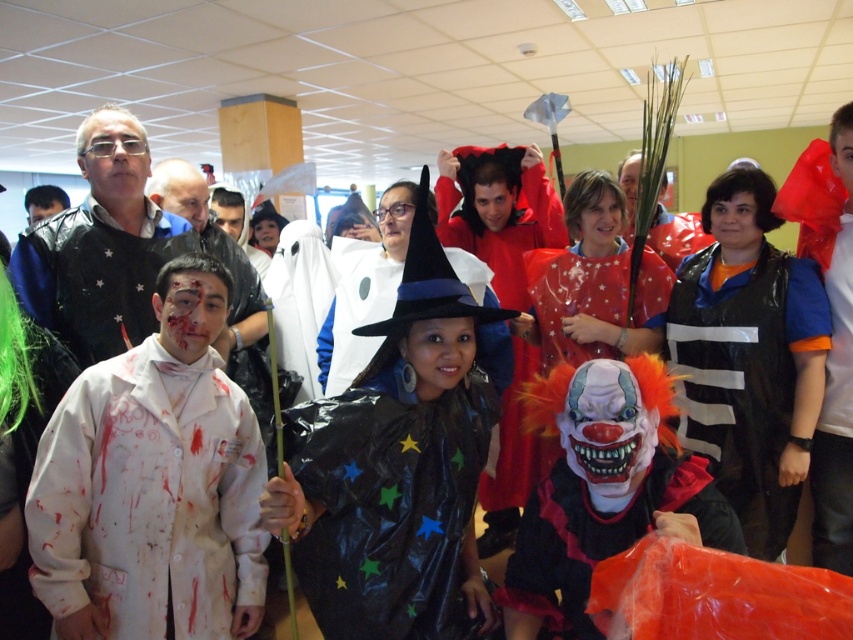
Question: Which of the following is the closest to the observer?

Choices:
 (A) (346, 452)
 (B) (155, 353)
 (C) (744, 477)
 (D) (701, 484)

Answer: (A)

Question: Can you confirm if shiny black cape at center is wider than black plastic vest at center-right?

Choices:
 (A) yes
 (B) no

Answer: (A)

Question: From the image, what is the correct spatial relationship of white matte lab coat at left in relation to black plastic vest at center-right?

Choices:
 (A) right
 (B) left

Answer: (B)

Question: Which of these objects is positioned farthest from the white matte lab coat at left?

Choices:
 (A) shiny black cape at center
 (B) black plastic vest at center-right

Answer: (B)

Question: Is shiny black cape at center to the left of white matte lab coat at left from the viewer's perspective?

Choices:
 (A) no
 (B) yes

Answer: (A)

Question: Among these objects, which one is nearest to the camera?

Choices:
 (A) rubber clown mask at center
 (B) white matte lab coat at left
 (C) shiny black cape at center

Answer: (C)